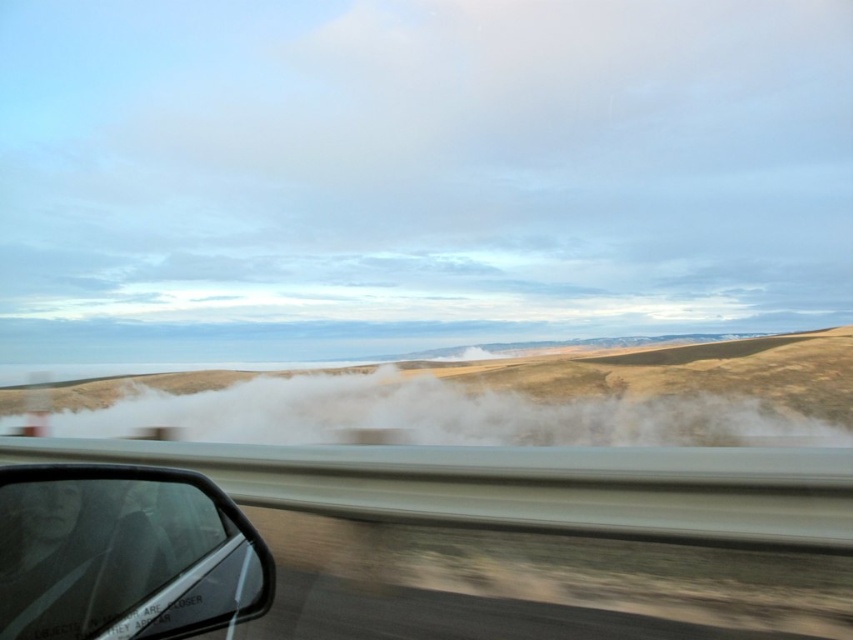
Is transparent plastic car window at lower left further to the viewer compared to white dusty cloud at center?

No, transparent plastic car window at lower left is closer to the viewer.

Which of these two, transparent plastic car window at lower left or white dusty cloud at center, stands shorter?

transparent plastic car window at lower left

What do you see at coordinates (125, 554) in the screenshot? I see `transparent plastic car window at lower left` at bounding box center [125, 554].

Locate an element on the screen. transparent plastic car window at lower left is located at coordinates (125, 554).

Between point (437, 260) and point (596, 444), which one is positioned behind?

Positioned behind is point (437, 260).

Can you confirm if cloudy sky at upper center is positioned to the right of white dusty cloud at center?

Indeed, cloudy sky at upper center is positioned on the right side of white dusty cloud at center.

Identify the location of cloudy sky at upper center. (425, 161).

Where is `cloudy sky at upper center`? The height and width of the screenshot is (640, 853). cloudy sky at upper center is located at coordinates pos(425,161).

Consider the image. Which of these two, cloudy sky at upper center or transparent plastic car window at lower left, stands taller?

cloudy sky at upper center

Between point (436, 304) and point (155, 522), which one is positioned in front?

Positioned in front is point (155, 522).

You are a GUI agent. You are given a task and a screenshot of the screen. Output one action in this format:
    pyautogui.click(x=<x>, y=<y>)
    Task: Click on the cloudy sky at upper center
    The height and width of the screenshot is (640, 853).
    Given the screenshot: What is the action you would take?
    pyautogui.click(x=425, y=161)